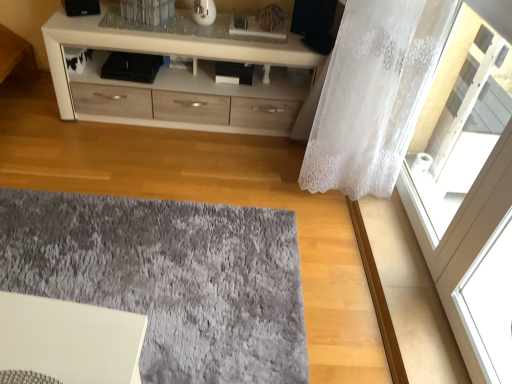
This screenshot has height=384, width=512. I want to click on blank space situated above white glossy cabinet at upper center (from a real-world perspective), so click(x=197, y=31).